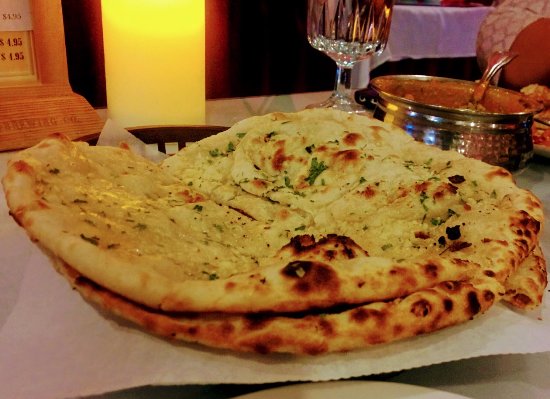
This screenshot has height=399, width=550. Identify the location of candle. (143, 67).